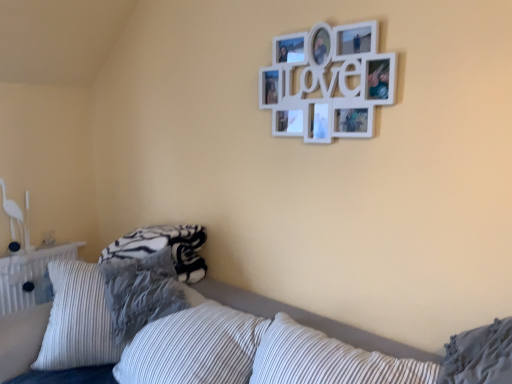
Question: Based on their positions, is textured gray pillow at lower left, acting as the second pillow starting from the right, located to the left or right of white striped pillow at lower right, acting as the first pillow starting from the front?

Choices:
 (A) right
 (B) left

Answer: (B)

Question: Relative to white striped pillow at lower right, the second pillow in the back-to-front sequence, is textured gray pillow at lower left, acting as the second pillow starting from the right, in front or behind?

Choices:
 (A) front
 (B) behind

Answer: (B)

Question: Estimate the real-world distances between objects in this image. Which object is farther from the textured gray pillow at lower left, which ranks as the first pillow in left-to-right order?

Choices:
 (A) white striped pillow at lower center
 (B) white matte picture frame at upper center
 (C) white striped pillow at lower right, acting as the first pillow starting from the front

Answer: (C)

Question: Which object is positioned farthest from the white matte picture frame at upper center?

Choices:
 (A) white striped pillow at lower center
 (B) white striped pillow at lower right, arranged as the first pillow when viewed from the right
 (C) textured gray pillow at lower left, which ranks as the first pillow in left-to-right order

Answer: (C)